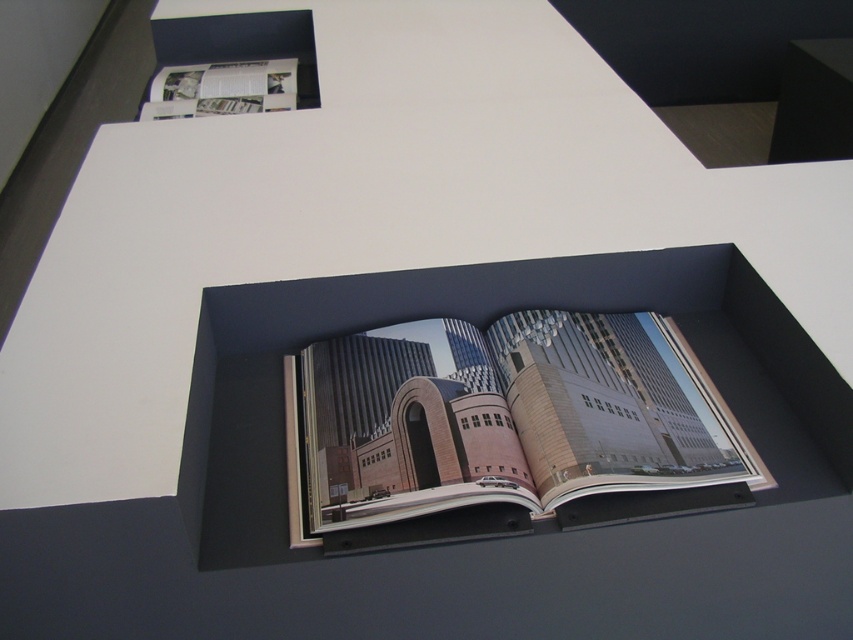
You are standing in the room and want to locate the matte paper book at center. According to the coordinates provided, where would you look to find it?

The matte paper book at center is located at point coordinates (503, 426).

You are organizing a display in the minimalist interior space. You need to place both the matte paper book at center and the white glossy magazine at upper left. According to their positions, which item is closer to the bottom of the shelf?

The matte paper book at center is closer to the bottom of the shelf because it is positioned under the white glossy magazine at upper left.